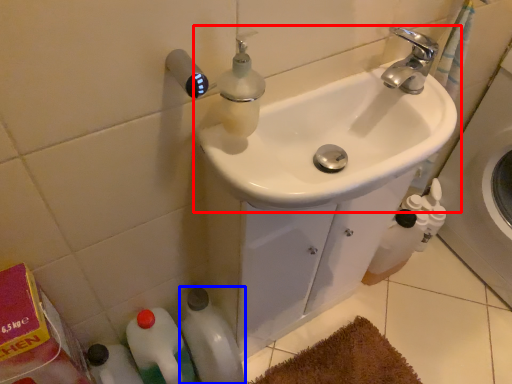
Question: Which object appears farthest to the camera in this image, sink (highlighted by a red box) or bottle (highlighted by a blue box)?

Choices:
 (A) sink
 (B) bottle

Answer: (B)